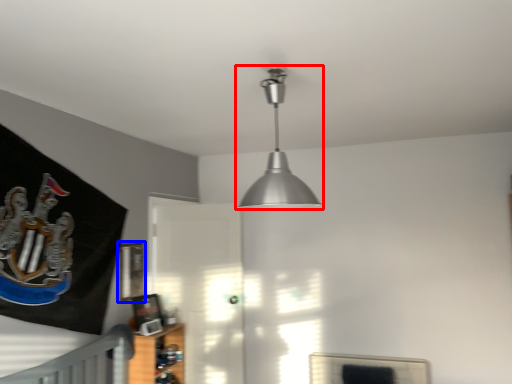
Question: Which object appears closest to the camera in this image, lamp (highlighted by a red box) or picture frame (highlighted by a blue box)?

Choices:
 (A) lamp
 (B) picture frame

Answer: (A)